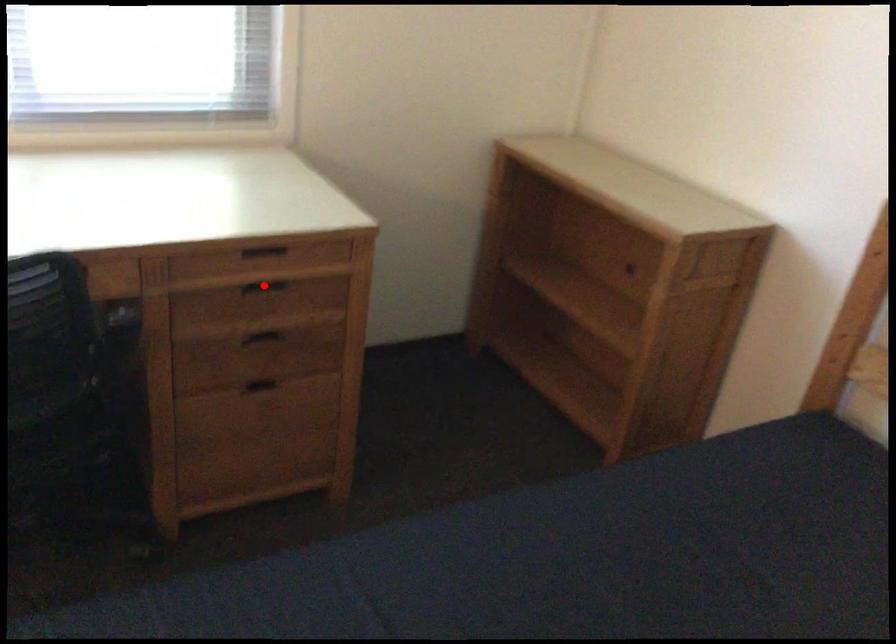
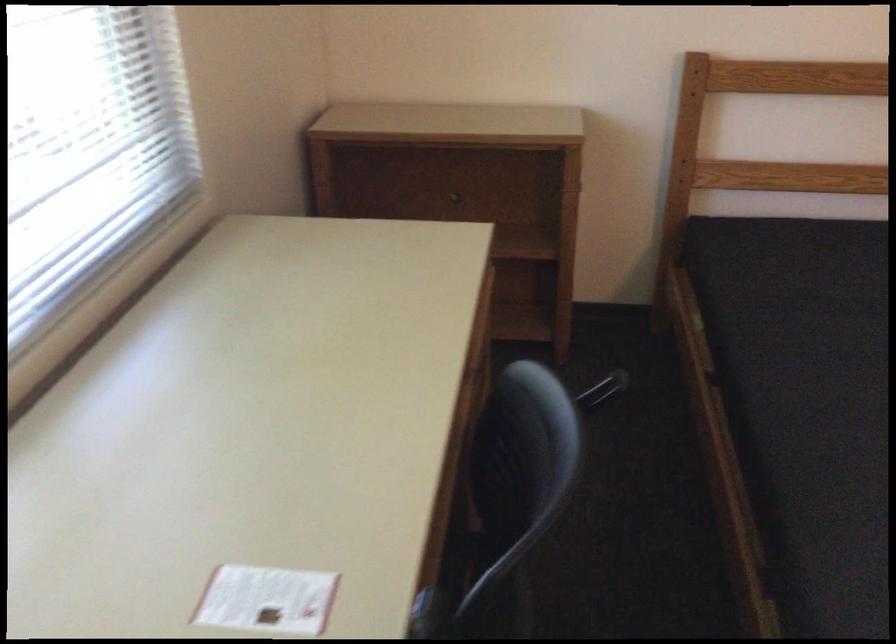
Question: I am providing you with two images of the same scene from different viewpoints. A red point is marked on the first image. Is the red point's position out of view in image 2?

Choices:
 (A) Yes
 (B) No

Answer: (A)